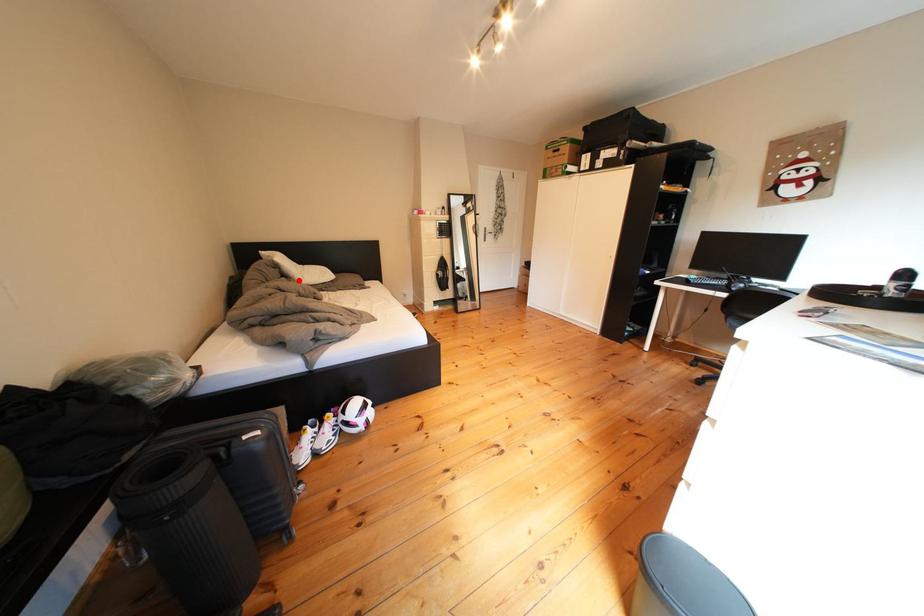
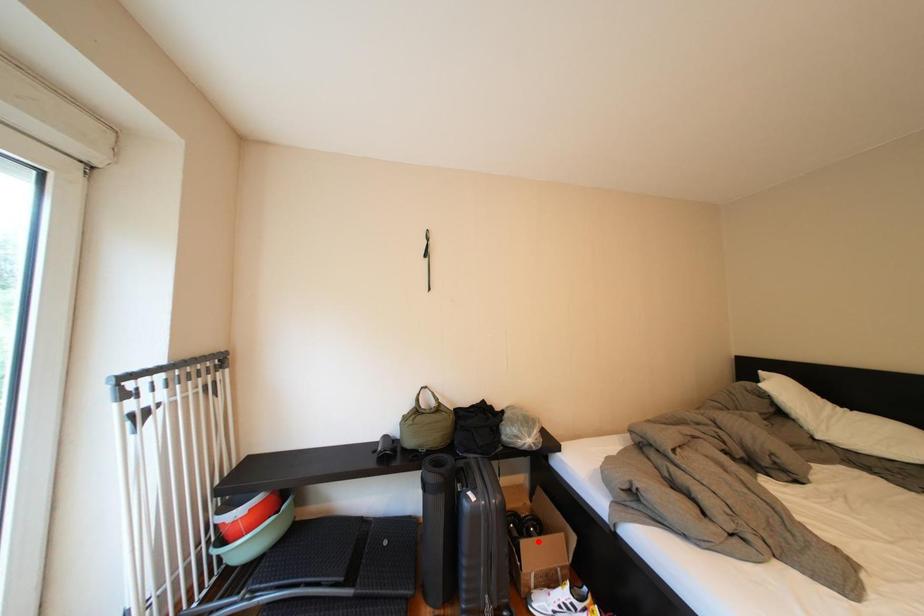
I am providing you with two images of the same scene from different viewpoints. A red point is marked on the first image and another point is marked on the second image. Do the highlighted points in image1 and image2 indicate the same real-world spot?

No